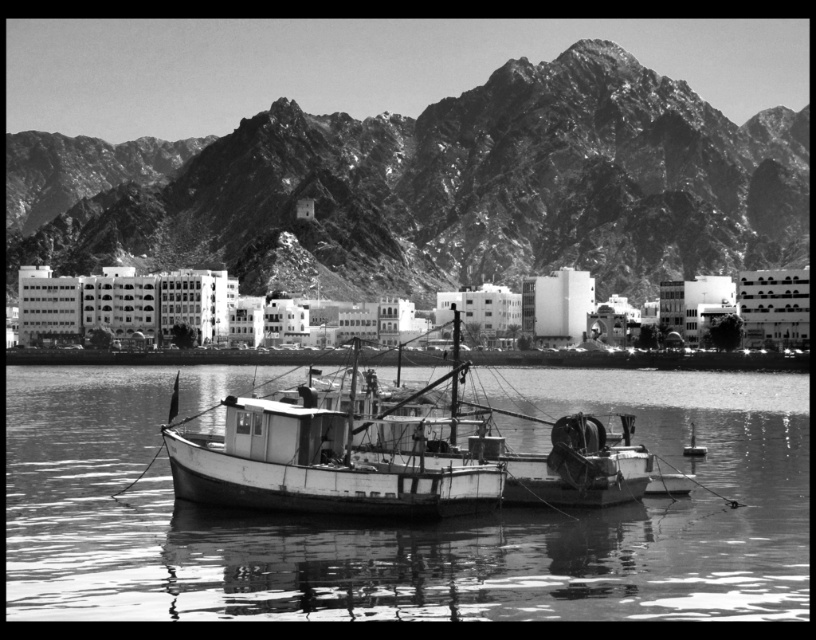
Is smooth white water at center smaller than white wooden boat at center?

Incorrect, smooth white water at center is not smaller in size than white wooden boat at center.

Is smooth white water at center thinner than white wooden boat at center?

Incorrect, smooth white water at center's width is not less than white wooden boat at center's.

Identify the location of smooth white water at center. [x=408, y=525].

Between rugged stone mountain at upper center and smooth white water at center, which one is positioned higher?

Positioned higher is rugged stone mountain at upper center.

Which is behind, point (686, 273) or point (384, 604)?

Positioned behind is point (686, 273).

Locate an element on the screen. The image size is (816, 640). rugged stone mountain at upper center is located at coordinates (433, 188).

Is rugged stone mountain at upper center shorter than white wooden boat at center?

No.

Is rugged stone mountain at upper center positioned behind white wooden boat at center?

Yes, rugged stone mountain at upper center is behind white wooden boat at center.

Between point (619, 166) and point (302, 488), which one is positioned in front?

Point (302, 488) is more forward.

You are a GUI agent. You are given a task and a screenshot of the screen. Output one action in this format:
    pyautogui.click(x=<x>, y=<y>)
    Task: Click on the rugged stone mountain at upper center
    Image resolution: width=816 pixels, height=640 pixels.
    Given the screenshot: What is the action you would take?
    pyautogui.click(x=433, y=188)